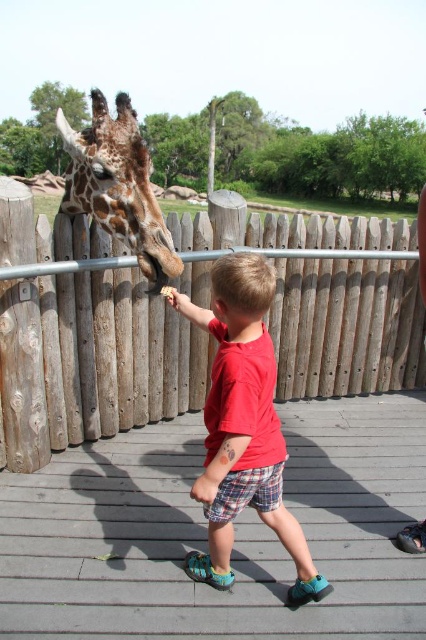
You are a zookeeper who needs to locate the red cotton shirt at center. According to the coordinate system where the bottom left corner is the origin, can you confirm if the red cotton shirt at center is located at point (242,426)?

Yes, the point (242,426) corresponds to the red cotton shirt at center.

You are standing at the point with coordinates [86,346] in the image. What object are you standing on?

The point at coordinates [86,346] corresponds to the wooden fence at center.